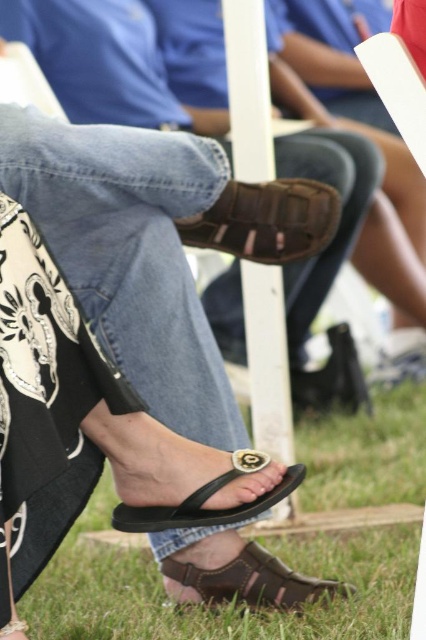
You are a photographer setting up for a group photo. You need to ensure that the green grass at lower center and the black leather sandal at lower center are exactly 1 meter apart for the composition. Based on the current setup, will you need to adjust their positions?

The green grass at lower center and the black leather sandal at lower center are currently 79.60 centimeters apart. Since 79.60 cm is less than 1 meter, you will need to move them farther apart to meet the 1 meter requirement.

You are a photographer trying to capture a close shot of the brown leather sandal at center and the brown leather sandal at lower center. Since your camera can only focus on one object at a time, which sandal should you choose to ensure the wider one is in focus?

The brown leather sandal at lower center is wider than the brown leather sandal at center, so you should focus on the brown leather sandal at lower center to ensure the wider one is in focus.